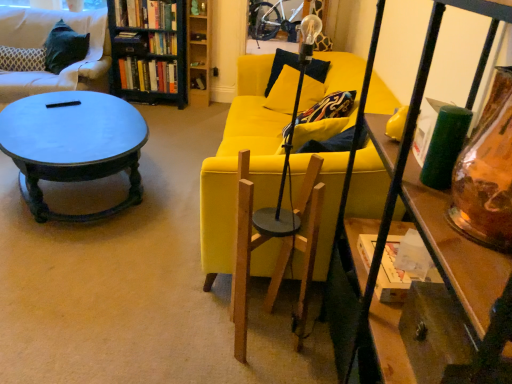
Question: Is hardcover books at upper left, which ranks as the first book in bottom-to-top order, taller than black painted wood bookcase at upper left?

Choices:
 (A) no
 (B) yes

Answer: (A)

Question: Is hardcover books at upper left, which ranks as the first book in bottom-to-top order, next to black painted wood bookcase at upper left and touching it?

Choices:
 (A) yes
 (B) no

Answer: (B)

Question: Can you confirm if hardcover books at upper left, which ranks as the first book in bottom-to-top order, is shorter than black painted wood bookcase at upper left?

Choices:
 (A) no
 (B) yes

Answer: (B)

Question: From the image's perspective, does hardcover books at upper left, which ranks as the first book in bottom-to-top order, appear higher than black painted wood bookcase at upper left?

Choices:
 (A) no
 (B) yes

Answer: (A)

Question: Is hardcover books at upper left, the 3th book from the top, at the left side of black painted wood bookcase at upper left?

Choices:
 (A) yes
 (B) no

Answer: (A)

Question: Does hardcover books at upper left, which ranks as the first book in bottom-to-top order, have a lesser width compared to black painted wood bookcase at upper left?

Choices:
 (A) yes
 (B) no

Answer: (A)

Question: Does velvet black pillow at upper left have a lesser height compared to clear glass lamp at center?

Choices:
 (A) no
 (B) yes

Answer: (B)

Question: Considering the relative positions of velvet black pillow at upper left and clear glass lamp at center in the image provided, is velvet black pillow at upper left behind clear glass lamp at center?

Choices:
 (A) yes
 (B) no

Answer: (A)

Question: Does velvet black pillow at upper left have a smaller size compared to clear glass lamp at center?

Choices:
 (A) no
 (B) yes

Answer: (A)

Question: Is velvet black pillow at upper left looking in the opposite direction of clear glass lamp at center?

Choices:
 (A) no
 (B) yes

Answer: (A)

Question: Is velvet black pillow at upper left aimed at clear glass lamp at center?

Choices:
 (A) yes
 (B) no

Answer: (B)

Question: Would you say velvet black pillow at upper left is a long distance from clear glass lamp at center?

Choices:
 (A) yes
 (B) no

Answer: (A)

Question: Is hardcover books at upper left, arranged as the 1th book when viewed from the top, at the left side of hardcover books at upper left, which ranks as the first book in bottom-to-top order?

Choices:
 (A) yes
 (B) no

Answer: (B)